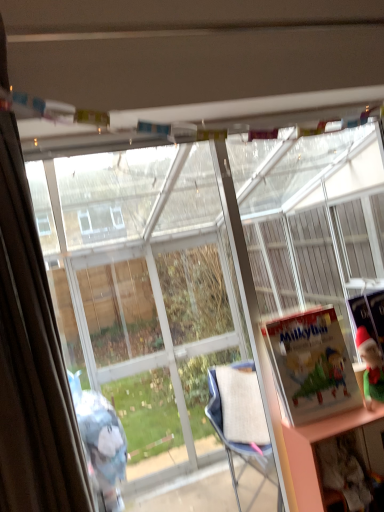
Image resolution: width=384 pixels, height=512 pixels. Describe the element at coordinates (32, 361) in the screenshot. I see `brown fabric curtain at left` at that location.

Measure the distance between transparent glass bay window at center and camera.

The depth of transparent glass bay window at center is 3.81 feet.

This screenshot has height=512, width=384. Find the location of `brown fabric curtain at left`. brown fabric curtain at left is located at coordinates (32, 361).

From the image's perspective, who appears lower, matte paper book at right, marked as the first book in a left-to-right arrangement, or transparent glass bay window at center?

matte paper book at right, marked as the first book in a left-to-right arrangement, is shown below in the image.

Is matte paper book at right, which is counted as the second book, starting from the back, with transparent glass bay window at center?

They are not placed beside each other.

Considering the relative sizes of matte paper book at right, placed as the first book when sorted from front to back, and transparent glass bay window at center in the image provided, is matte paper book at right, placed as the first book when sorted from front to back, wider than transparent glass bay window at center?

Indeed, matte paper book at right, placed as the first book when sorted from front to back, has a greater width compared to transparent glass bay window at center.

Is matte paper book at right, the 2th book positioned from the right, to the left of transparent glass bay window at center from the viewer's perspective?

No.

Is matte green book at right, which is the second book in left-to-right order, aimed at transparent glass bay window at center?

No, matte green book at right, which is the second book in left-to-right order, is not facing towards transparent glass bay window at center.

From a real-world perspective, is matte green book at right, which appears as the first book when viewed from the back, on transparent glass bay window at center?

No.

Is matte green book at right, which appears as the 1th book when viewed from the right, placed right next to transparent glass bay window at center?

They are not placed beside each other.

Considering the relative positions of matte green book at right, which is counted as the 2th book, starting from the front, and transparent glass bay window at center in the image provided, is matte green book at right, which is counted as the 2th book, starting from the front, to the left of transparent glass bay window at center from the viewer's perspective?

Incorrect, matte green book at right, which is counted as the 2th book, starting from the front, is not on the left side of transparent glass bay window at center.

Considering the sizes of objects brown fabric curtain at left and transparent glass bay window at center in the image provided, who is thinner, brown fabric curtain at left or transparent glass bay window at center?

transparent glass bay window at center.

Is brown fabric curtain at left positioned far away from transparent glass bay window at center?

Yes.

From a real-world perspective, relative to transparent glass bay window at center, is brown fabric curtain at left vertically above or below?

brown fabric curtain at left is situated higher than transparent glass bay window at center in the real world.

Between brown fabric curtain at left and transparent glass bay window at center, which one appears on the left side from the viewer's perspective?

Positioned to the left is brown fabric curtain at left.

Is brown fabric curtain at left shorter than matte paper book at right, marked as the first book in a left-to-right arrangement?

No.

Between brown fabric curtain at left and matte paper book at right, which is counted as the second book, starting from the back, which one has larger size?

With larger size is brown fabric curtain at left.

Is brown fabric curtain at left turned away from matte paper book at right, placed as the first book when sorted from front to back?

No.

In order to click on the 2nd book behind when counting from the brown fabric curtain at left in this screenshot , I will do `click(369, 315)`.

Is matte green book at right, which is counted as the 2th book, starting from the front, facing towards brown fabric curtain at left?

No, matte green book at right, which is counted as the 2th book, starting from the front, is not turned towards brown fabric curtain at left.

Considering the sizes of objects matte green book at right, which appears as the first book when viewed from the back, and brown fabric curtain at left in the image provided, who is thinner, matte green book at right, which appears as the first book when viewed from the back, or brown fabric curtain at left?

Thinner between the two is matte green book at right, which appears as the first book when viewed from the back.

In the scene shown: Is matte green book at right, which appears as the first book when viewed from the back, taller than brown fabric curtain at left?

No, matte green book at right, which appears as the first book when viewed from the back, is not taller than brown fabric curtain at left.

From a real-world perspective, is matte paper book at right, the 2th book positioned from the right, below matte green book at right, which is the second book in left-to-right order?

No, from a real-world perspective, matte paper book at right, the 2th book positioned from the right, is not under matte green book at right, which is the second book in left-to-right order.

How many degrees apart are the facing directions of matte paper book at right, the 2th book positioned from the right, and matte green book at right, which appears as the first book when viewed from the back?

2.47 degrees.

Which is behind, matte paper book at right, the 2th book positioned from the right, or matte green book at right, which is the second book in left-to-right order?

matte green book at right, which is the second book in left-to-right order, is further from the camera.

Is matte green book at right, which is counted as the 2th book, starting from the front, inside brown fabric curtain at left?

Definitely not — matte green book at right, which is counted as the 2th book, starting from the front, is not inside brown fabric curtain at left.

Can you confirm if brown fabric curtain at left is shorter than matte green book at right, which appears as the first book when viewed from the back?

Incorrect, the height of brown fabric curtain at left does not fall short of that of matte green book at right, which appears as the first book when viewed from the back.

Is brown fabric curtain at left aimed at matte green book at right, which appears as the 1th book when viewed from the right?

No, brown fabric curtain at left is not turned towards matte green book at right, which appears as the 1th book when viewed from the right.

Find the location of a particular element. The width and height of the screenshot is (384, 512). the 1st book below the transparent glass bay window at center (from a real-world perspective) is located at coordinates (312, 365).

I want to click on the 2nd book to the right of the transparent glass bay window at center, starting your count from the anchor, so click(369, 315).

Based on their spatial positions, is matte paper book at right, placed as the first book when sorted from front to back, or transparent glass bay window at center further from brown fabric curtain at left?

transparent glass bay window at center.

From the image, which object appears to be farther from matte green book at right, which appears as the 1th book when viewed from the right, brown fabric curtain at left or matte paper book at right, marked as the first book in a left-to-right arrangement?

brown fabric curtain at left is further to matte green book at right, which appears as the 1th book when viewed from the right.

Based on their spatial positions, is matte green book at right, which is counted as the 2th book, starting from the front, or brown fabric curtain at left further from matte paper book at right, marked as the first book in a left-to-right arrangement?

Among the two, brown fabric curtain at left is located further to matte paper book at right, marked as the first book in a left-to-right arrangement.

Estimate the real-world distances between objects in this image. Which object is closer to matte green book at right, which is counted as the 2th book, starting from the front, transparent glass bay window at center or matte paper book at right, which is counted as the second book, starting from the back?

Based on the image, matte paper book at right, which is counted as the second book, starting from the back, appears to be nearer to matte green book at right, which is counted as the 2th book, starting from the front.

Looking at this image, from the image, which object appears to be farther from brown fabric curtain at left, transparent glass bay window at center or matte green book at right, which is the second book in left-to-right order?

Among the two, transparent glass bay window at center is located further to brown fabric curtain at left.

When comparing their distances from brown fabric curtain at left, does matte green book at right, which appears as the 1th book when viewed from the right, or matte paper book at right, which is counted as the second book, starting from the back, seem further?

Based on the image, matte green book at right, which appears as the 1th book when viewed from the right, appears to be further to brown fabric curtain at left.

From the picture: Based on their spatial positions, is transparent glass bay window at center or matte green book at right, which appears as the first book when viewed from the back, further from matte paper book at right, the 2th book positioned from the right?

Based on the image, transparent glass bay window at center appears to be further to matte paper book at right, the 2th book positioned from the right.

From the image, which object appears to be farther from brown fabric curtain at left, matte green book at right, which is the second book in left-to-right order, or transparent glass bay window at center?

The object further to brown fabric curtain at left is transparent glass bay window at center.

This screenshot has height=512, width=384. I want to click on book between brown fabric curtain at left and matte green book at right, which appears as the 1th book when viewed from the right, so click(312, 365).

This screenshot has width=384, height=512. I want to click on bay window between brown fabric curtain at left and matte green book at right, which is the second book in left-to-right order, so click(146, 293).

Where is `book between transparent glass bay window at center and matte green book at right, which appears as the first book when viewed from the back, from left to right`? This screenshot has height=512, width=384. book between transparent glass bay window at center and matte green book at right, which appears as the first book when viewed from the back, from left to right is located at coordinates (312, 365).

I want to click on bay window situated between brown fabric curtain at left and matte paper book at right, the 2th book positioned from the right, from left to right, so click(146, 293).